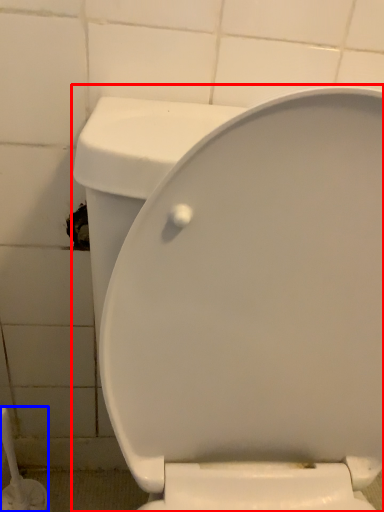
Question: Which object is further to the camera taking this photo, toilet (highlighted by a red box) or brush (highlighted by a blue box)?

Choices:
 (A) toilet
 (B) brush

Answer: (B)